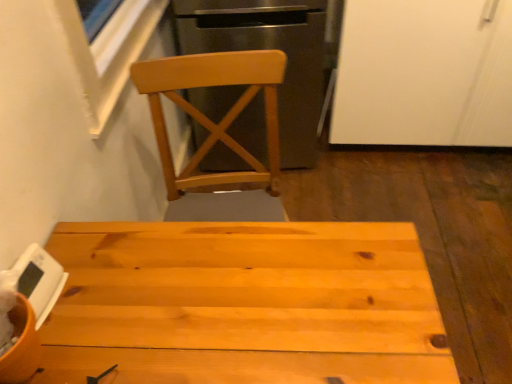
Describe the element at coordinates (39, 280) in the screenshot. This screenshot has width=512, height=384. I see `white matte digital clock at lower left` at that location.

Measure the distance between point (233,135) and camera.

A distance of 6.65 feet exists between point (233,135) and camera.

The height and width of the screenshot is (384, 512). What are the coordinates of `white matte digital clock at lower left` in the screenshot? It's located at (39, 280).

Is point (203, 14) closer or farther from the camera than point (317, 222)?

Point (203, 14) is positioned farther from the camera compared to point (317, 222).

Who is taller, light wood chair at upper center or natural wood table at center?

light wood chair at upper center is taller.

Does light wood chair at upper center have a lesser width compared to natural wood table at center?

Indeed, light wood chair at upper center has a lesser width compared to natural wood table at center.

Between light wood chair at upper center and natural wood table at center, which one appears on the left side from the viewer's perspective?

natural wood table at center is more to the left.

Is natural wood table at center to the left of white matte cabinet at upper right from the viewer's perspective?

Correct, you'll find natural wood table at center to the left of white matte cabinet at upper right.

Which point is more forward, (233, 223) or (399, 57)?

The point (233, 223) is closer to the camera.

Is natural wood table at center looking in the opposite direction of white matte cabinet at upper right?

That's not correct — natural wood table at center is not looking away from white matte cabinet at upper right.

Between light wood chair at upper center and white matte cabinet at upper right, which one has smaller width?

With smaller width is light wood chair at upper center.

Who is more distant, light wood chair at upper center or white matte cabinet at upper right?

white matte cabinet at upper right.

Considering the positions of point (310, 117) and point (423, 77), is point (310, 117) closer or farther from the camera than point (423, 77)?

Point (310, 117) is farther from the camera than point (423, 77).

Image resolution: width=512 pixels, height=384 pixels. Find the location of `leftover located above the white matte cabinet at upper right (from a real-world perspective)`. leftover located above the white matte cabinet at upper right (from a real-world perspective) is located at coordinates (268, 49).

Are white matte cabinet at upper right and light wood chair at upper center far apart?

No, there isn't a large distance between white matte cabinet at upper right and light wood chair at upper center.

From a real-world perspective, is white matte cabinet at upper right physically below light wood chair at upper center?

Yes, from a real-world perspective, white matte cabinet at upper right is below light wood chair at upper center.

From the image's perspective, is white matte cabinet at upper right located above light wood chair at upper center?

Yes.

Based on the photo, do you think white matte digital clock at lower left is within natural wood table at center, or outside of it?

white matte digital clock at lower left is not enclosed by natural wood table at center.

From a real-world perspective, which object rests below the other?

natural wood table at center is physically lower.

Is white matte digital clock at lower left wider than natural wood table at center?

No, white matte digital clock at lower left is not wider than natural wood table at center.

From a real-world perspective, is natural wood table at center positioned above or below light wood chair at upper center?

In terms of real-world spatial position, natural wood table at center is below light wood chair at upper center.

Does point (337, 257) come closer to viewer compared to point (318, 79)?

Yes, point (337, 257) is in front of point (318, 79).

Is the position of natural wood table at center more distant than that of light wood chair at upper center?

No, natural wood table at center is in front of light wood chair at upper center.

Is natural wood table at center taller than light wood chair at upper center?

No.

How many degrees apart are the facing directions of light wood chair at upper center and white matte digital clock at lower left?

83.2 degrees.

Is light wood chair at upper center at the left side of white matte digital clock at lower left?

In fact, light wood chair at upper center is to the right of white matte digital clock at lower left.

Is light wood chair at upper center inside the boundaries of white matte digital clock at lower left, or outside?

light wood chair at upper center cannot be found inside white matte digital clock at lower left.

From a real-world perspective, is light wood chair at upper center physically above white matte digital clock at lower left?

No, from a real-world perspective, light wood chair at upper center is not over white matte digital clock at lower left

At what (x,y) coordinates should I click in order to perform the action: click on table to the left of light wood chair at upper center. Please return your answer as a coordinate pair (x, y). The width and height of the screenshot is (512, 384). Looking at the image, I should click on (244, 304).

Locate an element on the screen. The width and height of the screenshot is (512, 384). screen door lying behind the natural wood table at center is located at coordinates (424, 73).

From the image, which object appears to be farther from light wood chair at upper center, white matte digital clock at lower left or natural wood table at center?

Among the two, white matte digital clock at lower left is located further to light wood chair at upper center.

Considering their positions, is white matte cabinet at upper right positioned further to natural wood table at center than light wood chair at upper center?

The object further to natural wood table at center is white matte cabinet at upper right.

When comparing their distances from white matte cabinet at upper right, does light wood chair at upper center or white matte digital clock at lower left seem closer?

light wood chair at upper center is positioned closer to the anchor white matte cabinet at upper right.

Looking at this image, which object lies nearer to the anchor point white matte digital clock at lower left, natural wood table at center or light wood chair at upper center?

natural wood table at center.

Considering their positions, is natural wood table at center positioned closer to white matte digital clock at lower left than white matte cabinet at upper right?

natural wood table at center is closer to white matte digital clock at lower left.

Which object lies nearer to the anchor point white matte cabinet at upper right, natural wood table at center or white matte digital clock at lower left?

Among the two, natural wood table at center is located nearer to white matte cabinet at upper right.

Estimate the real-world distances between objects in this image. Which object is further from white matte cabinet at upper right, light wood chair at upper center or natural wood table at center?

Among the two, natural wood table at center is located further to white matte cabinet at upper right.

Estimate the real-world distances between objects in this image. Which object is further from white matte digital clock at lower left, white matte cabinet at upper right or natural wood table at center?

white matte cabinet at upper right is further to white matte digital clock at lower left.

Where is `leftover between white matte cabinet at upper right and natural wood table at center from top to bottom`? Image resolution: width=512 pixels, height=384 pixels. leftover between white matte cabinet at upper right and natural wood table at center from top to bottom is located at coordinates (268, 49).

Locate an element on the screen. The image size is (512, 384). table between white matte digital clock at lower left and white matte cabinet at upper right in the horizontal direction is located at coordinates (244, 304).

This screenshot has width=512, height=384. I want to click on appliance that lies between light wood chair at upper center and natural wood table at center from top to bottom, so click(39, 280).

At what (x,y) coordinates should I click in order to perform the action: click on leftover located between white matte digital clock at lower left and white matte cabinet at upper right in the left-right direction. Please return your answer as a coordinate pair (x, y). Looking at the image, I should click on (268, 49).